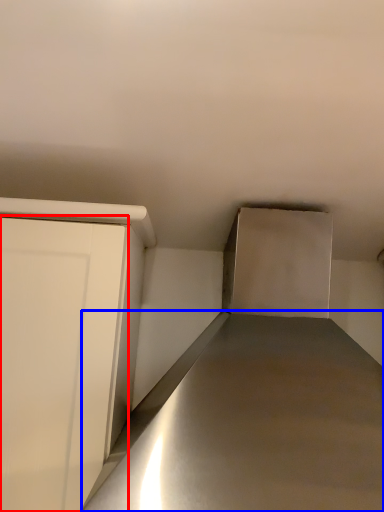
Question: Which point is further to the camera, door (highlighted by a red box) or counter top (highlighted by a blue box)?

Choices:
 (A) door
 (B) counter top

Answer: (A)